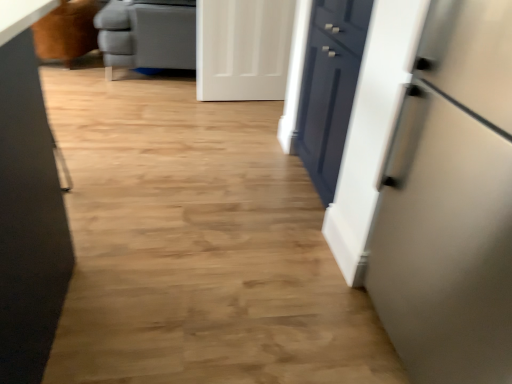
Where is `vacant space situated on the left part of glossy dark blue drawer at center right`? This screenshot has height=384, width=512. vacant space situated on the left part of glossy dark blue drawer at center right is located at coordinates (237, 187).